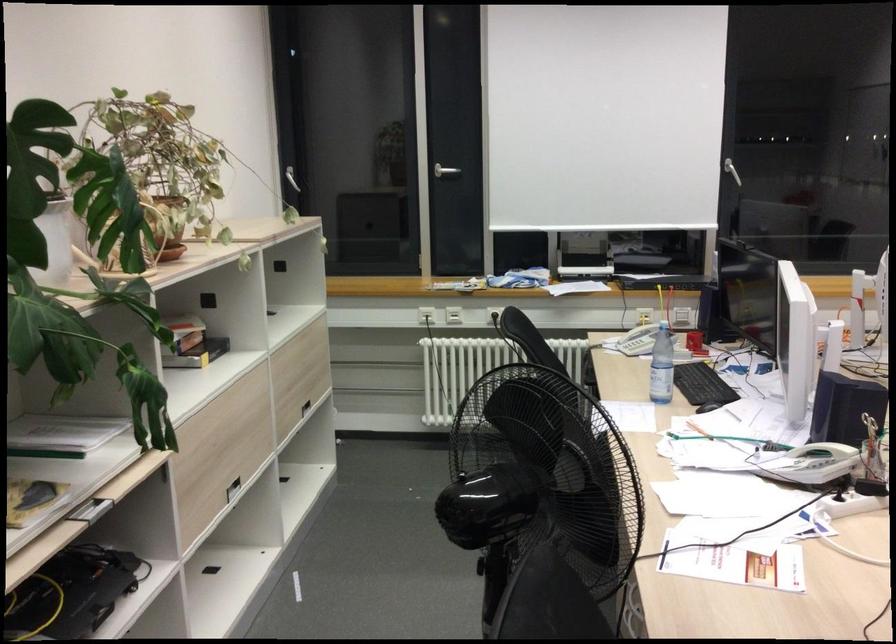
At what (x,y) coordinates should I click in order to perform the action: click on silver door handle. Please return your answer as a coordinate pair (x, y). The width and height of the screenshot is (896, 644). Looking at the image, I should click on pyautogui.click(x=445, y=171).